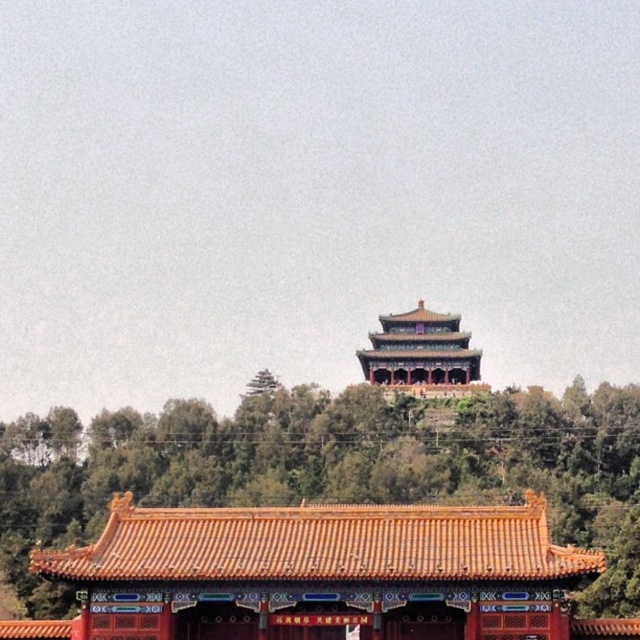
Can you confirm if orange glazed tile roof at center is shorter than orange glazed tile palace at center?

No.

Does orange glazed tile roof at center have a greater width compared to orange glazed tile palace at center?

Yes.

What do you see at coordinates (321, 572) in the screenshot? The width and height of the screenshot is (640, 640). I see `orange glazed tile roof at center` at bounding box center [321, 572].

Identify the location of orange glazed tile roof at center. The height and width of the screenshot is (640, 640). (321, 572).